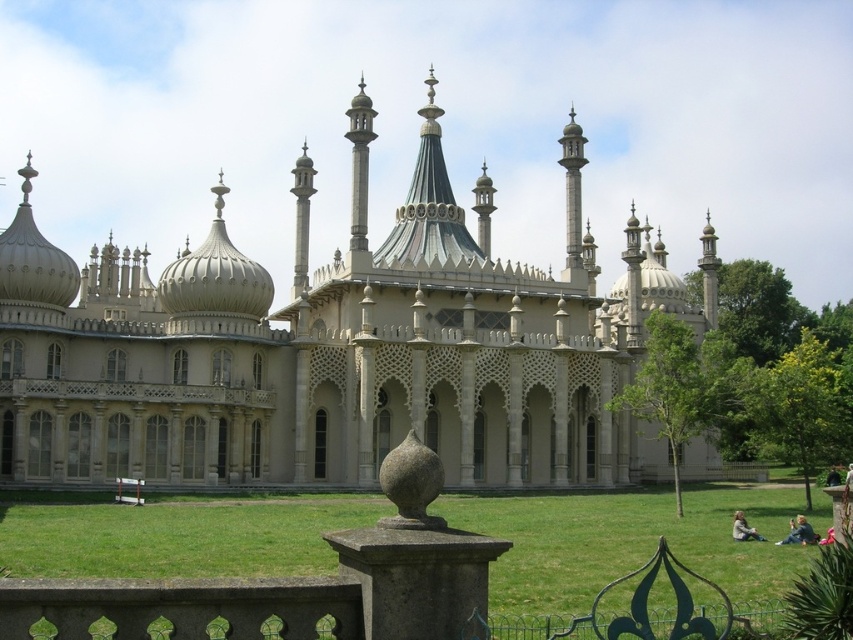
Is green grass at lower center wider than light brown hair at lower right?

Yes.

I want to click on green grass at lower center, so click(x=627, y=541).

Find the location of a particular element. This screenshot has height=640, width=853. green grass at lower center is located at coordinates (627, 541).

Which is behind, point (425, 468) or point (355, 228)?

Positioned behind is point (355, 228).

Is point (436, 461) in front of point (360, 211)?

Yes, point (436, 461) is in front of point (360, 211).

Identify the location of smooth stone vase at center. The width and height of the screenshot is (853, 640). (410, 484).

Does point (184, 522) lie in front of point (784, 541)?

No, (184, 522) is further to viewer.

Is green grass at lower center wider than blue denim jacket at lower right?

Correct, the width of green grass at lower center exceeds that of blue denim jacket at lower right.

Is point (560, 515) less distant than point (799, 528)?

No, (560, 515) is further to viewer.

Where is `green grass at lower center`? This screenshot has height=640, width=853. green grass at lower center is located at coordinates (627, 541).